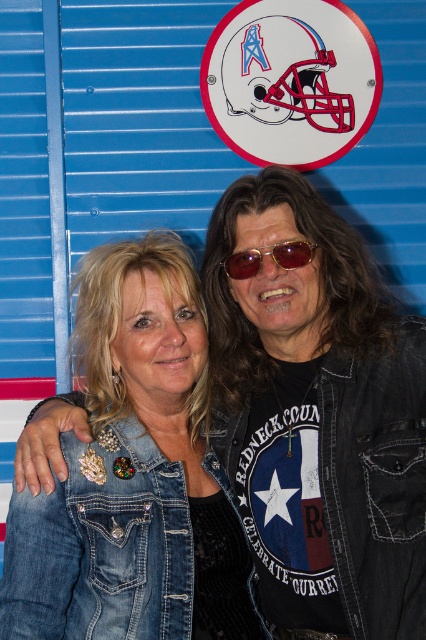
You are a photographer adjusting the camera focus. You want to focus on the denim jacket at lower right and the gold reflective sunglasses at center. Which object should you adjust the focus to first if you want to ensure both are in focus?

The denim jacket at lower right is in front of the gold reflective sunglasses at center, so you should focus on the denim jacket at lower right first to ensure both are in focus.

You are a photographer who wants to ensure both denim jackets are visible in your photo. Based on their positions, can you adjust your angle so that both the denim jacket at center and the denim jacket at lower right are fully visible without any obstruction?

The denim jacket at center is in front of the denim jacket at lower right. To ensure both are fully visible, adjust your angle to capture the denim jacket at center from the side so it doesn not block the denim jacket at lower right behind it.

You are a photographer adjusting the camera focus. The denim jacket at center and gold reflective sunglasses at center are both in the frame. Which object is positioned lower in the image?

The denim jacket at center is located below the gold reflective sunglasses at center, so the denim jacket at center is positioned lower in the image.